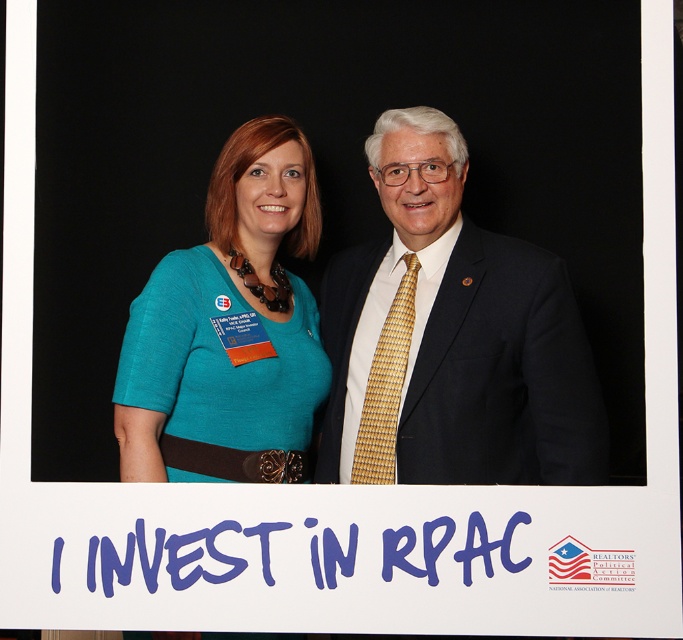
You are a photographer adjusting the focus of your camera. You want to ensure that both the teal fabric dress at center and the gold woven tie at center are in sharp focus. Given their positions, which one should you focus on first to achieve this?

Since the teal fabric dress at center is closer to the viewer than the gold woven tie at center, you should focus on the teal fabric dress at center first to ensure both are in sharp focus.

What object is located at the coordinates point [451,337] in the image?

The point [451,337] indicates the matte black suit at center.